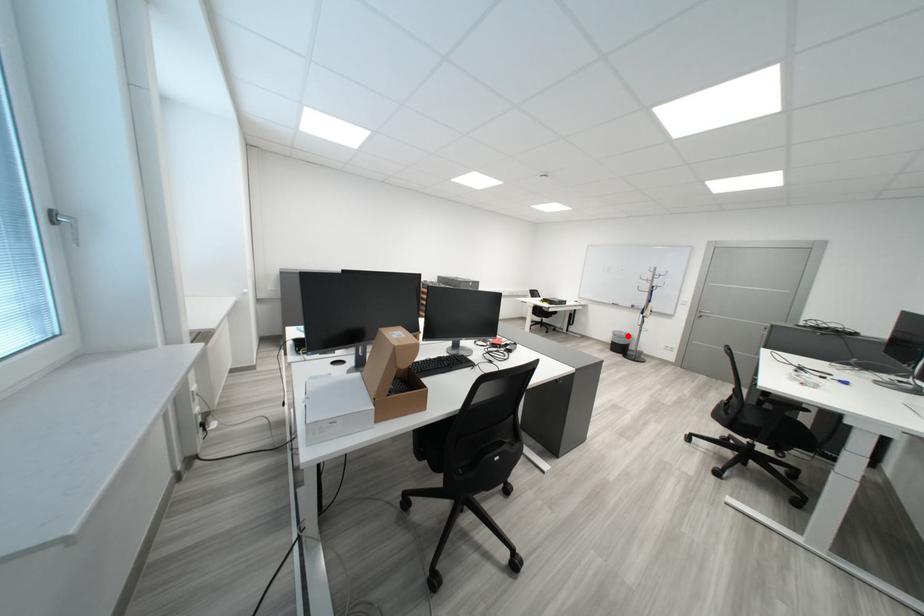
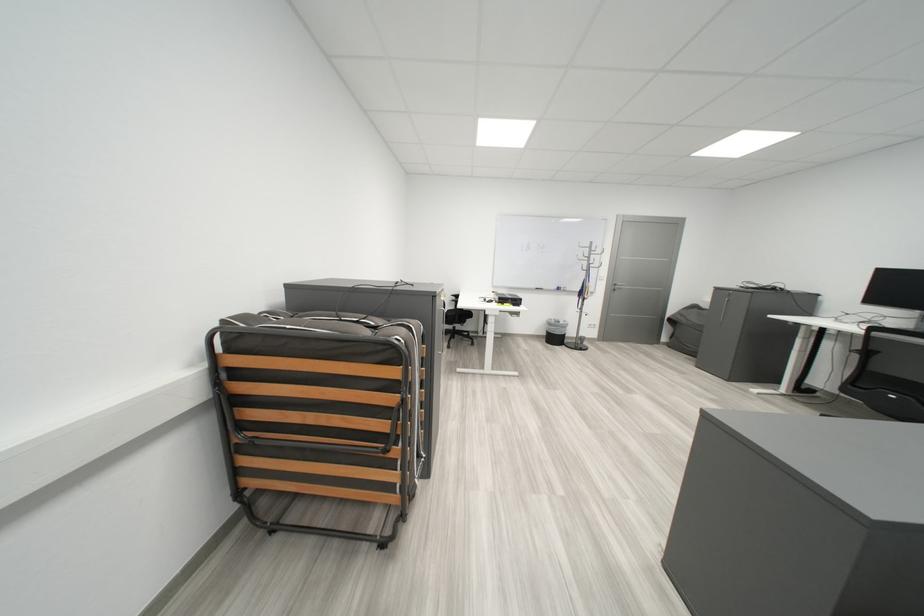
Question: I am providing you with two images of the same scene from different viewpoints. A red point is shown in image1. For the corresponding object point in image2, is it positioned nearer or farther from the camera?

Choices:
 (A) Nearer
 (B) Farther

Answer: (B)